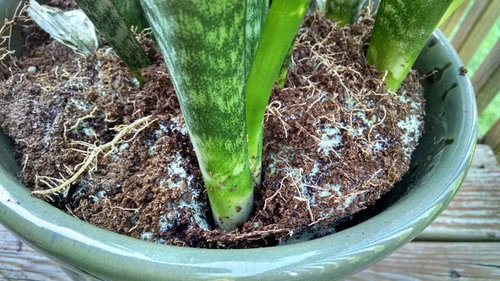
Find the location of a particular element. plant is located at coordinates (223, 99), (414, 33), (347, 10), (253, 22), (125, 51), (131, 10), (73, 28), (265, 79).